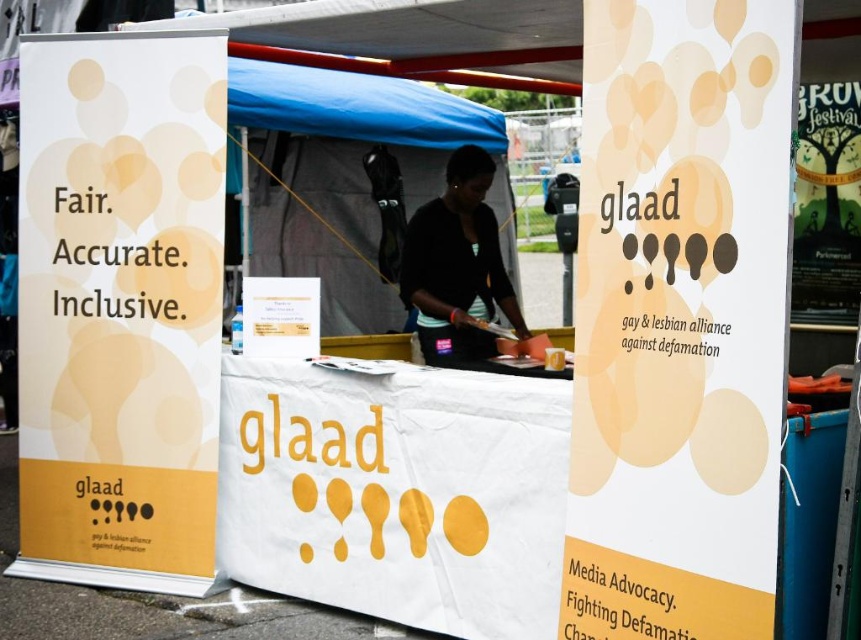
Is blue fabric tent at center to the right of black matte shirt at center from the viewer's perspective?

No, blue fabric tent at center is not to the right of black matte shirt at center.

Between point (435, 188) and point (440, 285), which one is positioned in front?

Point (440, 285) is more forward.

You are a GUI agent. You are given a task and a screenshot of the screen. Output one action in this format:
    pyautogui.click(x=<x>, y=<y>)
    Task: Click on the blue fabric tent at center
    This screenshot has width=861, height=640.
    Given the screenshot: What is the action you would take?
    pyautogui.click(x=356, y=180)